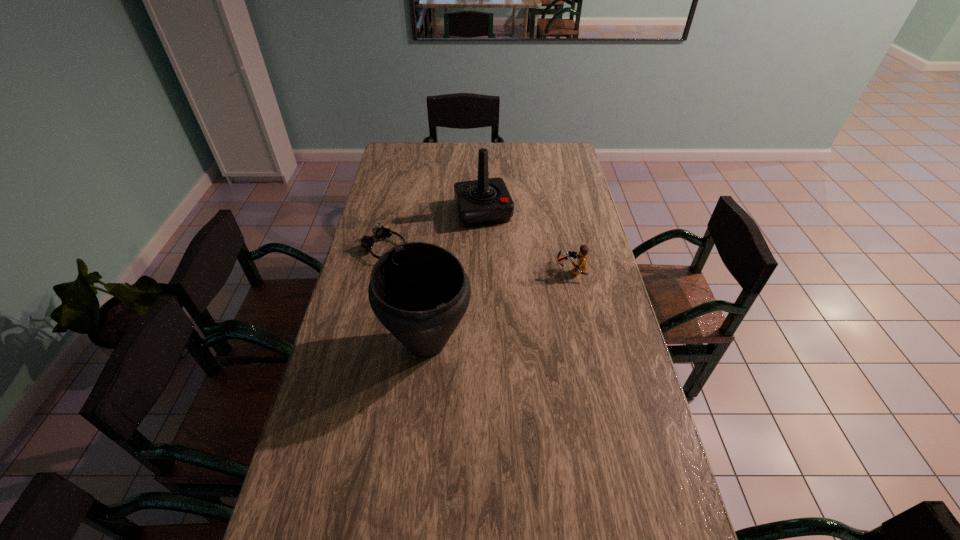
Locate an element on the screen. vacant space on the desktop that is between the urn and the Lego and is positioned on the front-facing side of the joystick is located at coordinates (515, 299).

Locate an element on the screen. The width and height of the screenshot is (960, 540). vacant spot on the desktop that is between the urn and the rightmost object and is positioned through the lenses of the shortest object is located at coordinates (500, 306).